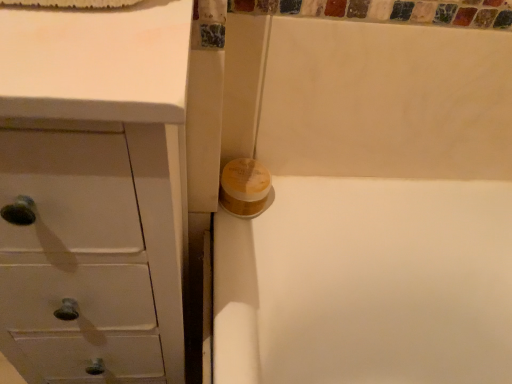
Question: From a real-world perspective, is yellow matte toilet paper at center positioned over white matte chest of drawers at left based on gravity?

Choices:
 (A) no
 (B) yes

Answer: (B)

Question: Can you confirm if yellow matte toilet paper at center is shorter than white matte chest of drawers at left?

Choices:
 (A) no
 (B) yes

Answer: (B)

Question: Is yellow matte toilet paper at center positioned before white matte chest of drawers at left?

Choices:
 (A) no
 (B) yes

Answer: (A)

Question: Would you consider yellow matte toilet paper at center to be distant from white matte chest of drawers at left?

Choices:
 (A) yes
 (B) no

Answer: (B)

Question: Is yellow matte toilet paper at center positioned with its back to white matte chest of drawers at left?

Choices:
 (A) no
 (B) yes

Answer: (A)

Question: From a real-world perspective, is yellow matte toilet paper at center physically below white matte chest of drawers at left?

Choices:
 (A) yes
 (B) no

Answer: (B)

Question: From the image's perspective, is white matte chest of drawers at left on yellow matte toilet paper at center?

Choices:
 (A) yes
 (B) no

Answer: (B)

Question: Is white matte chest of drawers at left not within yellow matte toilet paper at center?

Choices:
 (A) yes
 (B) no

Answer: (A)

Question: Would you say white matte chest of drawers at left is a long distance from yellow matte toilet paper at center?

Choices:
 (A) no
 (B) yes

Answer: (A)

Question: From a real-world perspective, is white matte chest of drawers at left on top of yellow matte toilet paper at center?

Choices:
 (A) yes
 (B) no

Answer: (B)

Question: Can you confirm if white matte chest of drawers at left is smaller than yellow matte toilet paper at center?

Choices:
 (A) yes
 (B) no

Answer: (B)

Question: Is white matte chest of drawers at left oriented towards yellow matte toilet paper at center?

Choices:
 (A) yes
 (B) no

Answer: (B)

Question: In terms of height, does yellow matte toilet paper at center look taller or shorter compared to white matte chest of drawers at left?

Choices:
 (A) tall
 (B) short

Answer: (B)